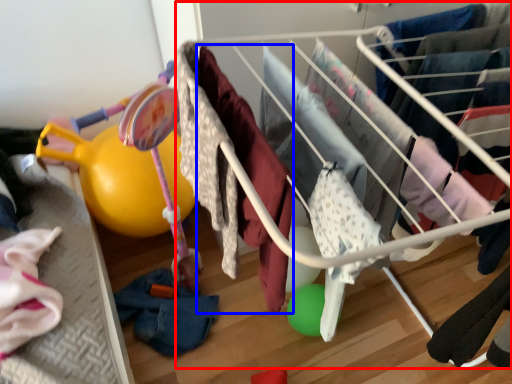
Question: Which point is further to the camera, infant bed (highlighted by a red box) or clothing (highlighted by a blue box)?

Choices:
 (A) infant bed
 (B) clothing

Answer: (A)